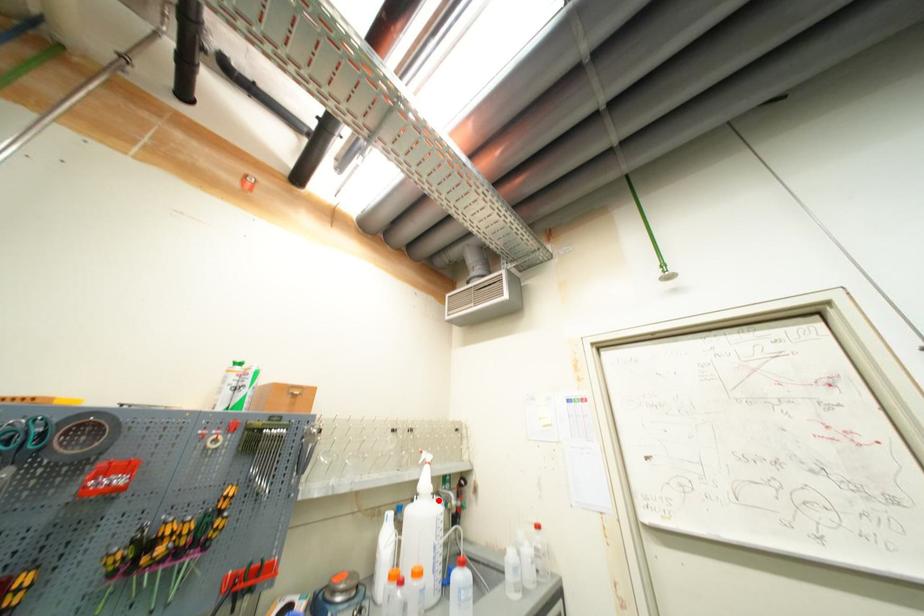
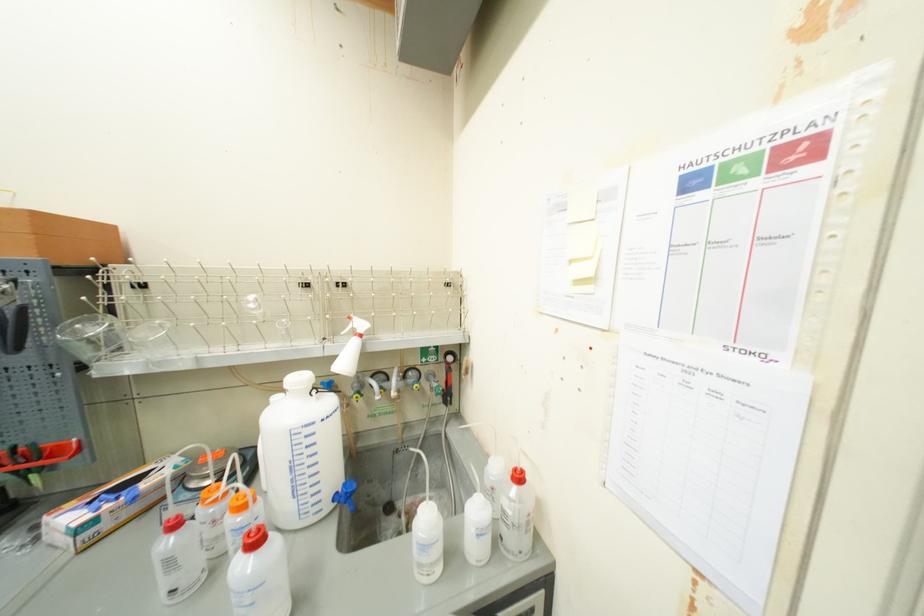
Question: I am providing you with two images of the same scene from different viewpoints. Given a red point in image1, look at the same physical point in image2. Is it:

Choices:
 (A) Closer to the viewpoint
 (B) Farther from the viewpoint

Answer: (A)